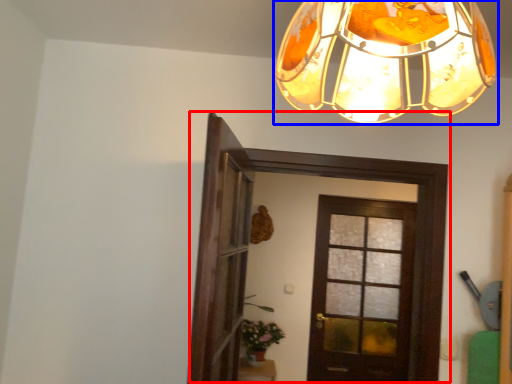
Question: Which object is further to the camera taking this photo, door (highlighted by a red box) or lamp (highlighted by a blue box)?

Choices:
 (A) door
 (B) lamp

Answer: (A)